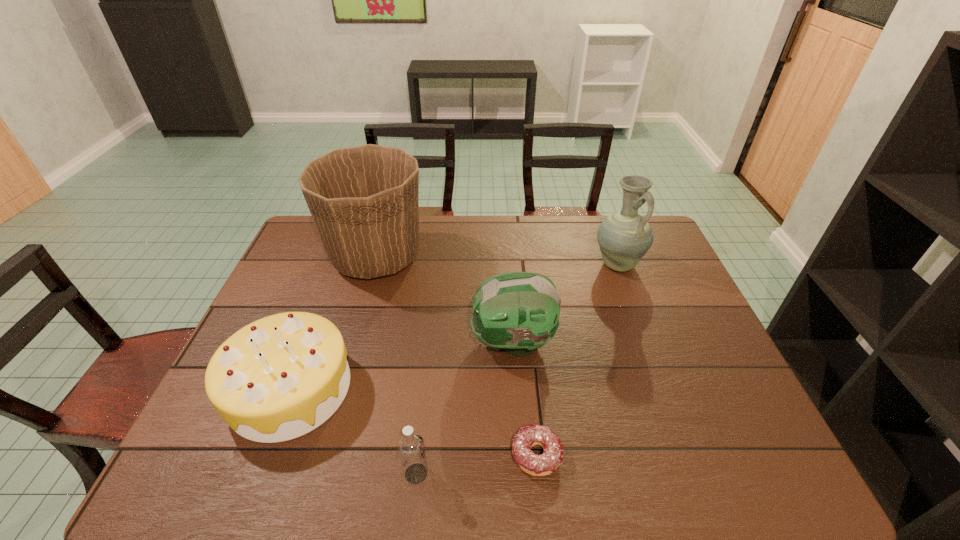
Where is `vacant point that satisfies the following two spatial constraints: 1. on the visor of the fourth shortest object; 2. on the back side of the doughnut`? Image resolution: width=960 pixels, height=540 pixels. vacant point that satisfies the following two spatial constraints: 1. on the visor of the fourth shortest object; 2. on the back side of the doughnut is located at coordinates (521, 455).

Locate an element on the screen. vacant space that satisfies the following two spatial constraints: 1. on the handle side of the rightmost object; 2. on the visor of the football helmet is located at coordinates (646, 342).

What are the coordinates of `free spot that satisfies the following two spatial constraints: 1. on the visor of the football helmet; 2. on the front side of the birthday cake` in the screenshot? It's located at (516, 388).

Where is `vacant space that satisfies the following two spatial constraints: 1. on the visor of the third tallest object; 2. on the right side of the doughnut`? The height and width of the screenshot is (540, 960). vacant space that satisfies the following two spatial constraints: 1. on the visor of the third tallest object; 2. on the right side of the doughnut is located at coordinates (521, 455).

This screenshot has height=540, width=960. What are the coordinates of `vacant region that satisfies the following two spatial constraints: 1. on the visor of the fourth shortest object; 2. on the right side of the doughnut` in the screenshot? It's located at (521, 455).

Locate an element on the screen. Image resolution: width=960 pixels, height=540 pixels. free space that satisfies the following two spatial constraints: 1. on the handle side of the pitcher; 2. on the visor of the third tallest object is located at coordinates (646, 342).